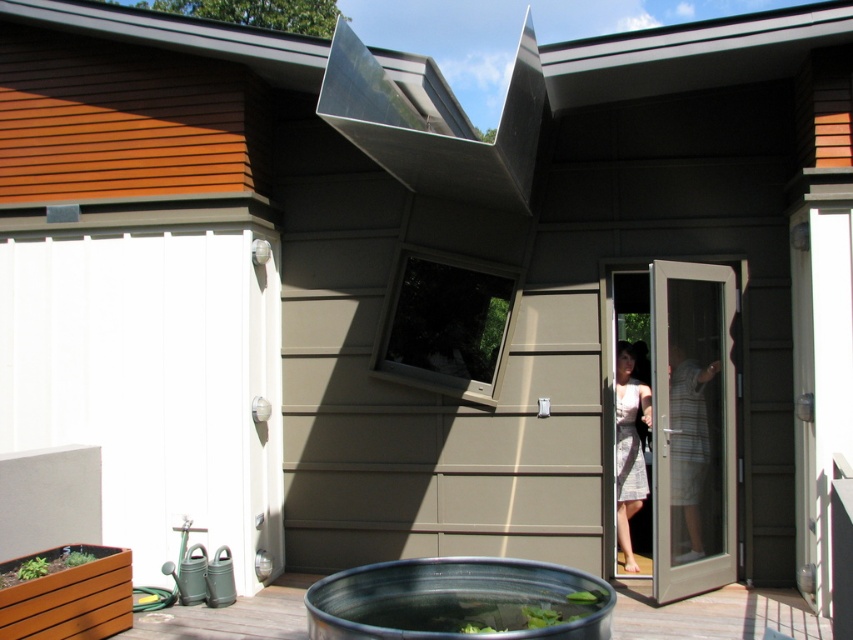
You are planning to place a new bench in the garden. The bench requires a space larger than the smooth wooden deck at lower left. Is there enough space at the location where the striped cotton shirt at door is placed?

The smooth wooden deck at lower left has a smaller size compared to striped cotton shirt at door, so the space at the striped cotton shirt at door is larger. Therefore, the bench can be placed there as it meets the required space.

You are standing at the entrance of the house and want to locate the metallic silver tub at lower center. According to the coordinates provided, where should you look relative to the entrance?

The metallic silver tub at lower center is located at coordinates point (x=457, y=600), which would be towards the lower center area of the image from the entrance.